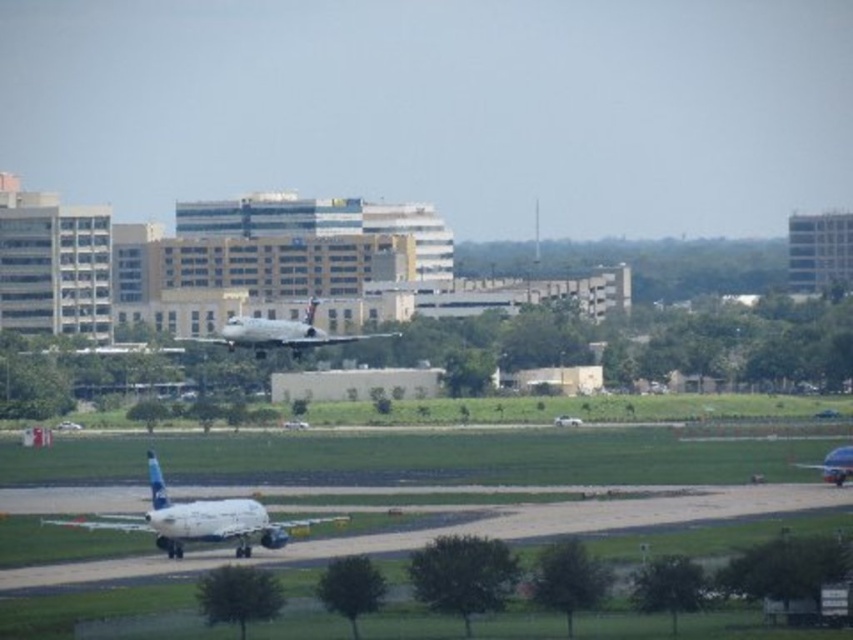
Question: Does white matte airplane at lower left have a greater width compared to silver metallic airplane at center?

Choices:
 (A) yes
 (B) no

Answer: (A)

Question: Which point is closer to the camera?

Choices:
 (A) (248, 337)
 (B) (194, 509)

Answer: (B)

Question: Which object appears farthest from the camera in this image?

Choices:
 (A) silver metallic airplane at center
 (B) white matte airplane at lower left

Answer: (A)

Question: Is white matte airplane at lower left below silver metallic airplane at center?

Choices:
 (A) no
 (B) yes

Answer: (B)

Question: Can you confirm if white matte airplane at lower left is positioned to the left of silver metallic airplane at center?

Choices:
 (A) no
 (B) yes

Answer: (B)